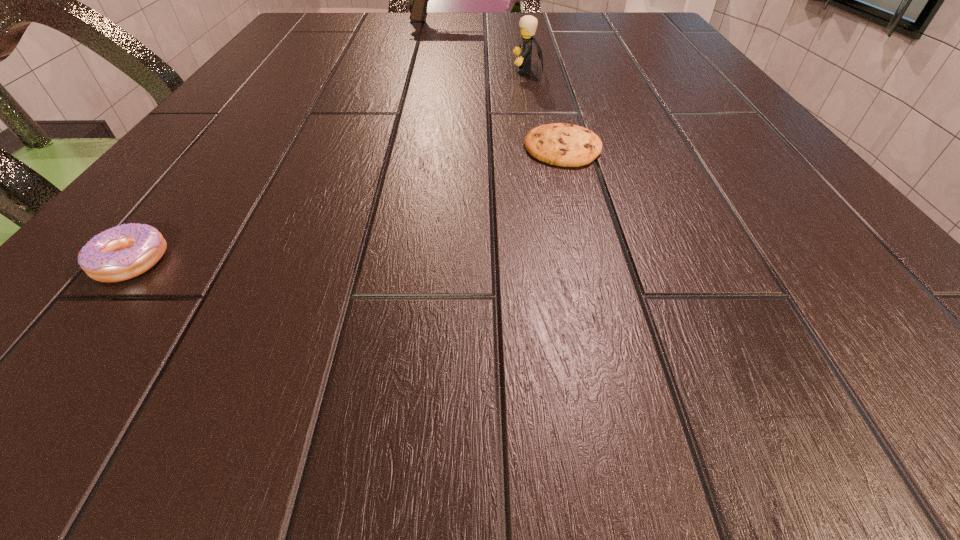
Locate an element on the screen. free point located 0.370m on the front-facing side of the third nearest object is located at coordinates tap(326, 70).

This screenshot has width=960, height=540. I want to click on free spot located on the back of the doughnut, so click(191, 185).

Where is `blank area located 0.380m on the back of the shortest object`? This screenshot has width=960, height=540. blank area located 0.380m on the back of the shortest object is located at coordinates (537, 45).

Locate an element on the screen. The image size is (960, 540). object that is at the far edge is located at coordinates (420, 0).

At what (x,y) coordinates should I click in order to perform the action: click on object located at the left edge. Please return your answer as a coordinate pair (x, y). This screenshot has height=540, width=960. Looking at the image, I should click on (123, 252).

I want to click on vacant area at the far edge, so click(427, 41).

Where is `vacant space at the near edge of the desktop`? The width and height of the screenshot is (960, 540). vacant space at the near edge of the desktop is located at coordinates (463, 332).

Locate an element on the screen. This screenshot has height=540, width=960. vacant area at the left edge of the desktop is located at coordinates (281, 50).

In order to click on free space at the right edge of the desktop in this screenshot , I will do `click(724, 172)`.

This screenshot has width=960, height=540. Identify the location of free location at the far left corner of the desktop. (300, 30).